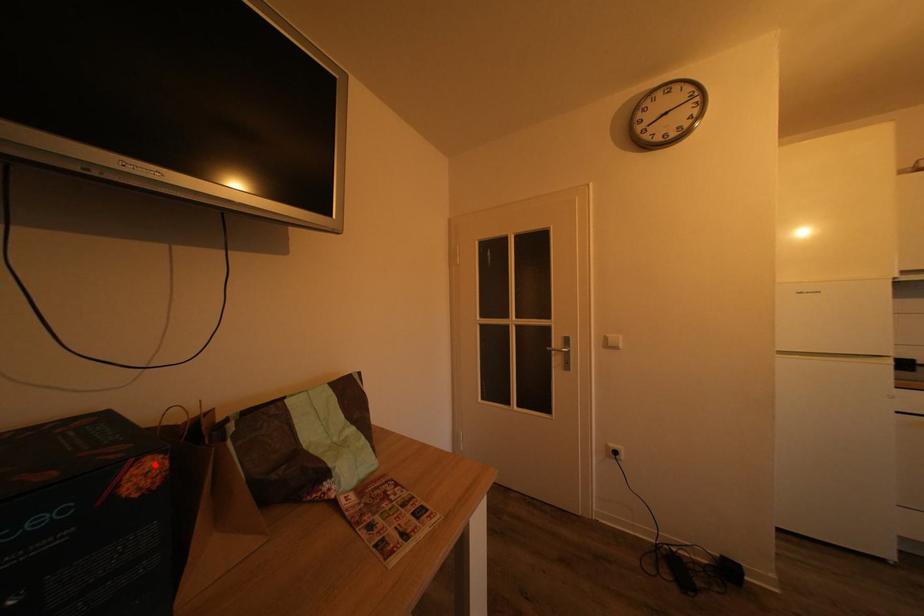
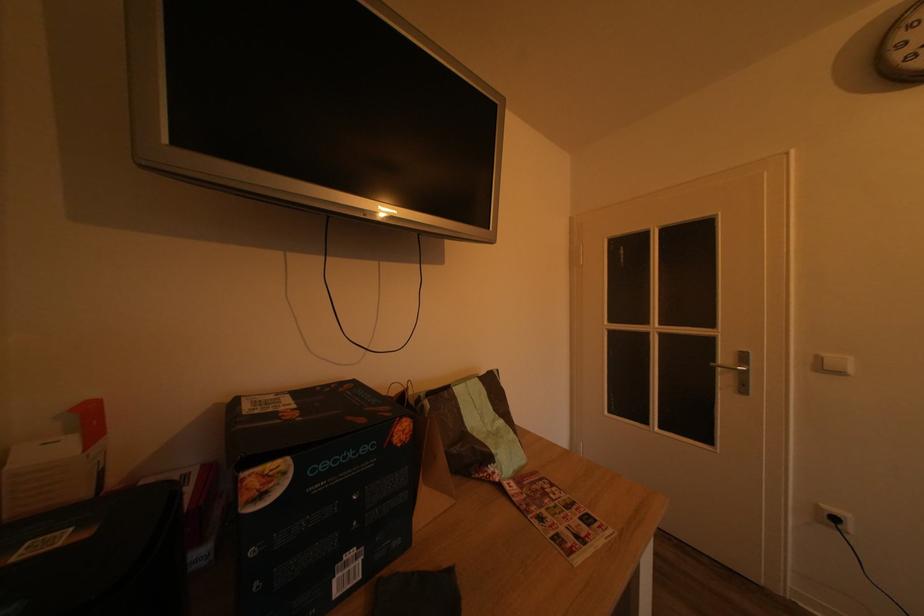
Where in the second image is the point corresponding to the highlighted location from the first image?

(411, 426)